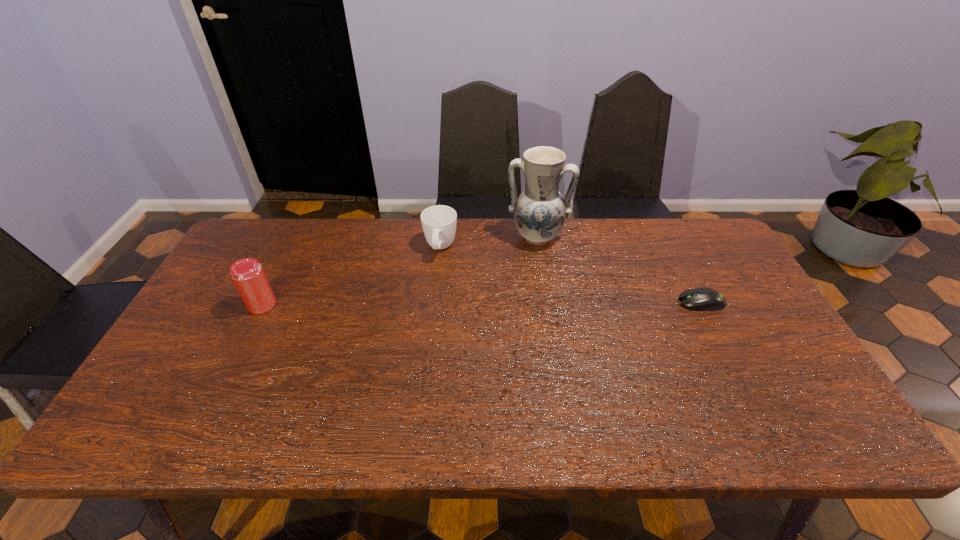
At what (x,y) coordinates should I click in order to perform the action: click on the second tallest object. Please return your answer as a coordinate pair (x, y). The width and height of the screenshot is (960, 540). Looking at the image, I should click on 247,274.

This screenshot has width=960, height=540. Find the location of `the leftmost object`. the leftmost object is located at coordinates (247, 274).

I want to click on the shortest object, so click(x=701, y=299).

This screenshot has width=960, height=540. Find the location of `the rightmost object`. the rightmost object is located at coordinates (701, 299).

Find the location of a particular element. The height and width of the screenshot is (540, 960). the second object from right to left is located at coordinates (540, 210).

Locate an element on the screen. the tallest object is located at coordinates (540, 210).

Identify the location of cup. This screenshot has height=540, width=960. (438, 222).

Identify the location of the third tallest object. (438, 222).

Image resolution: width=960 pixels, height=540 pixels. Identify the location of free space located 0.370m on the right of the leftmost object. (407, 305).

What are the coordinates of `free region located 0.260m on the wheel side of the computer mouse` in the screenshot? It's located at (587, 302).